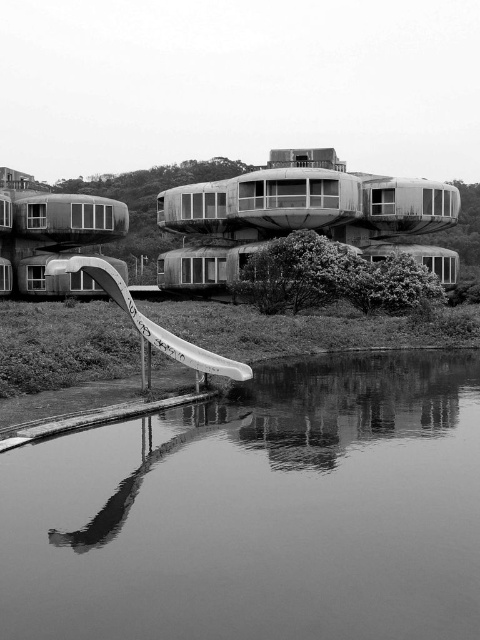
You are standing at the edge of the water in the scene. There is a point marked at coordinates point (x=259, y=513). What is located at that point?

The smooth water at bottom center is located at point (x=259, y=513).

Looking at this image, you are a photographer standing at the edge of the smooth water at bottom center. You want to capture a closeup shot of the curved slide in the midground. Can you step forward to get closer to the slide without entering the water?

The smooth water at bottom center is 4.16 meters from the camera. Since the photographer is standing at the edge of the water, they are already at the closest point to the slide without entering the water. Moving forward would require stepping into the water.

You are standing at the edge of the smooth water at bottom center and want to walk to the white plastic slide at lower left. Which direction should you go?

You should walk to the left because the smooth water at bottom center is positioned on the right side of white plastic slide at lower left, meaning the slide is to the left of the water.